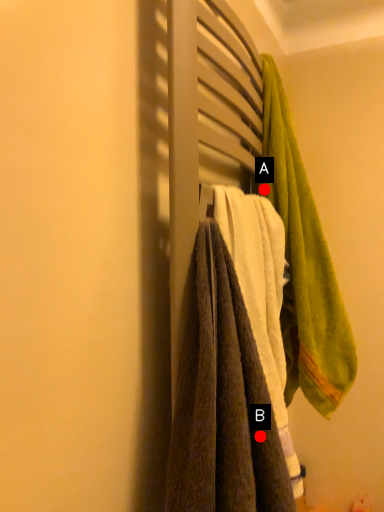
Question: Two points are circled on the image, labeled by A and B beside each circle. Which point is farther to the camera?

Choices:
 (A) A is further
 (B) B is further

Answer: (A)